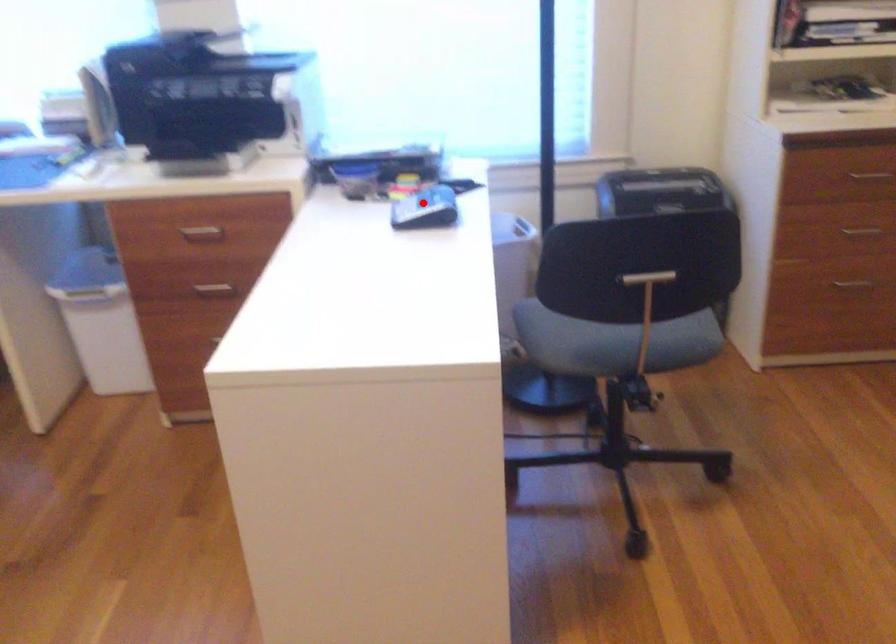
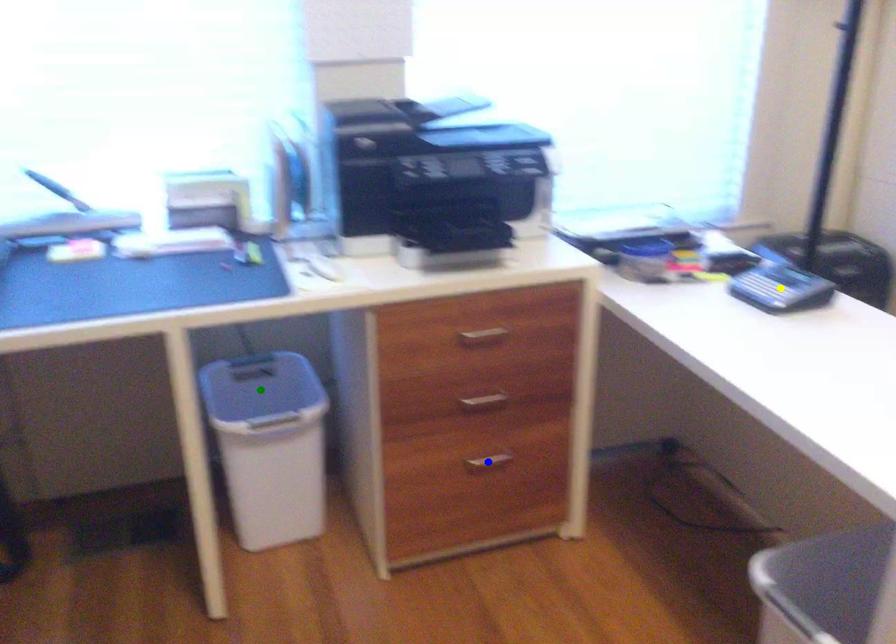
Question: I am providing you with two images of the same scene from different viewpoints. A red point is marked on the first image. You are given multiple points on the second image. In image 2, which mark is for the same physical point as the one in image 1?

Choices:
 (A) green point
 (B) yellow point
 (C) blue point

Answer: (B)